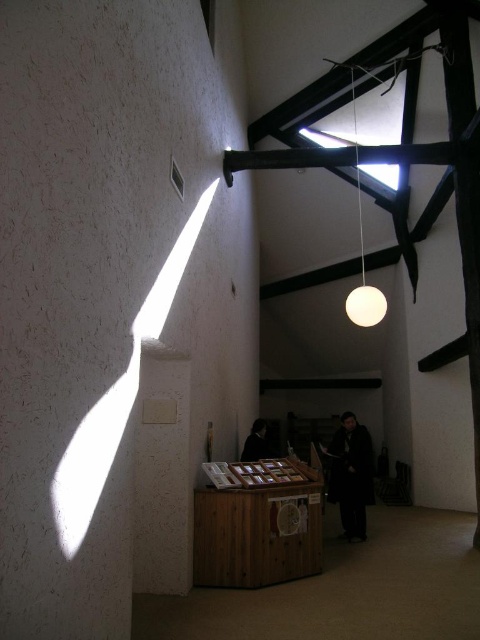
Based on the photo, you are an interior designer who needs to place a decorative item between the dark wool coat at center and the white matte sphere at upper center. Given that the minimum distance required between any two items is 5 feet, can you position the new item in this space?

The dark wool coat at center and white matte sphere at upper center are 6.03 feet apart from each other. Since the minimum distance required is 5 feet, you can place the new decorative item between them as the existing distance allows for it.

You are an interior designer assessing the lighting in the room. You notice the white textured pillar at left and the white matte sphere at upper center. Which object casts a longer shadow given their heights and the position of the skylight?

The white textured pillar at left is much taller than the white matte sphere at upper center, so it would cast a longer shadow.

You are standing in the room and want to place a new object between the white textured pillar at left and the white matte sphere at upper center. Based on their positions, which object should you start moving first to create space?

The white textured pillar at left is closer to the viewer than the white matte sphere at upper center, so you should move the white textured pillar at left first to create space.